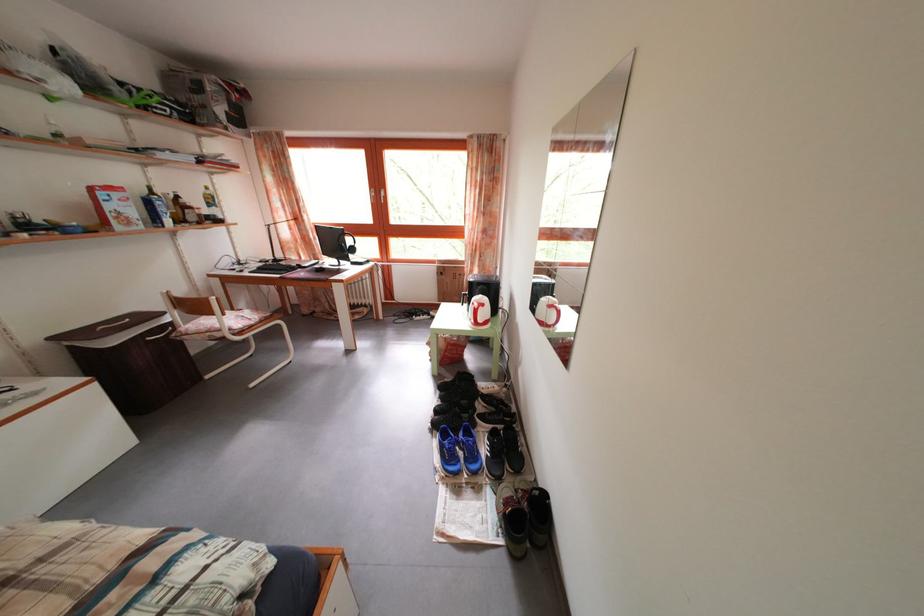
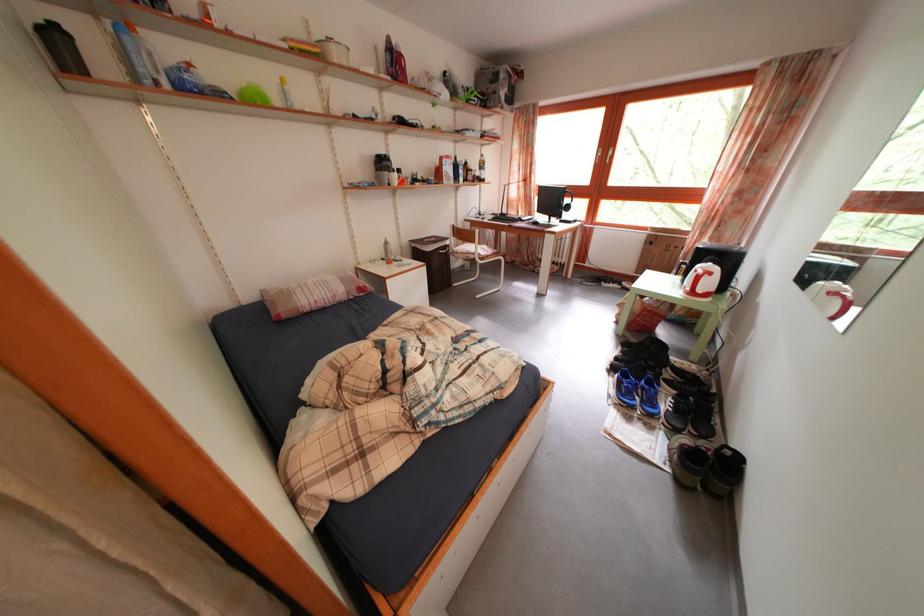
Question: The camera is either moving clockwise (left) or counter-clockwise (right) around the object. The first image is from the beginning of the video and the second image is from the end. Is the camera moving left or right when shooting the video?

Choices:
 (A) Left
 (B) Right

Answer: (B)